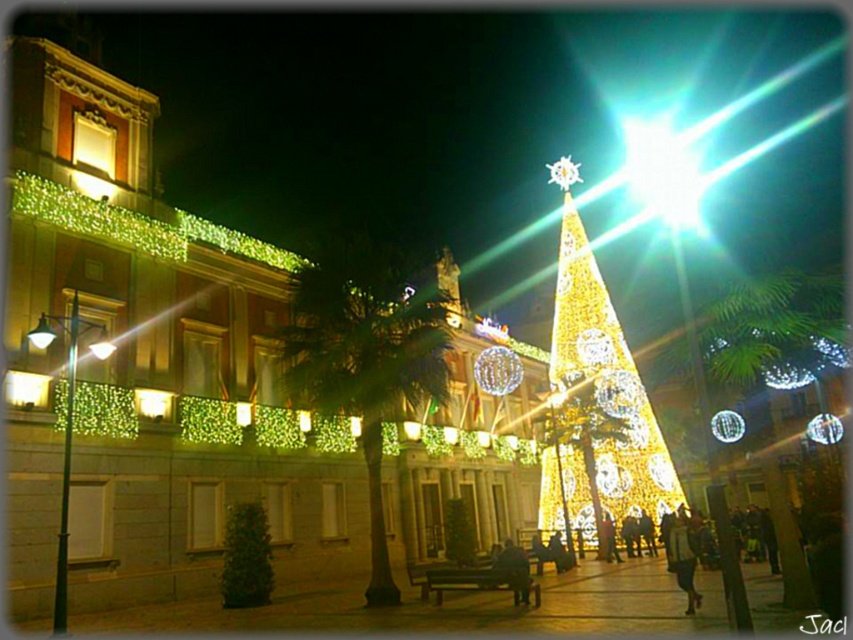
Is green leafy palm tree at center to the right of illuminated gold christmas tree at center from the viewer's perspective?

In fact, green leafy palm tree at center is to the left of illuminated gold christmas tree at center.

Consider the image. Is green leafy palm tree at center taller than illuminated gold christmas tree at center?

In fact, green leafy palm tree at center may be shorter than illuminated gold christmas tree at center.

Locate an element on the screen. The image size is (853, 640). green leafy palm tree at center is located at coordinates (364, 365).